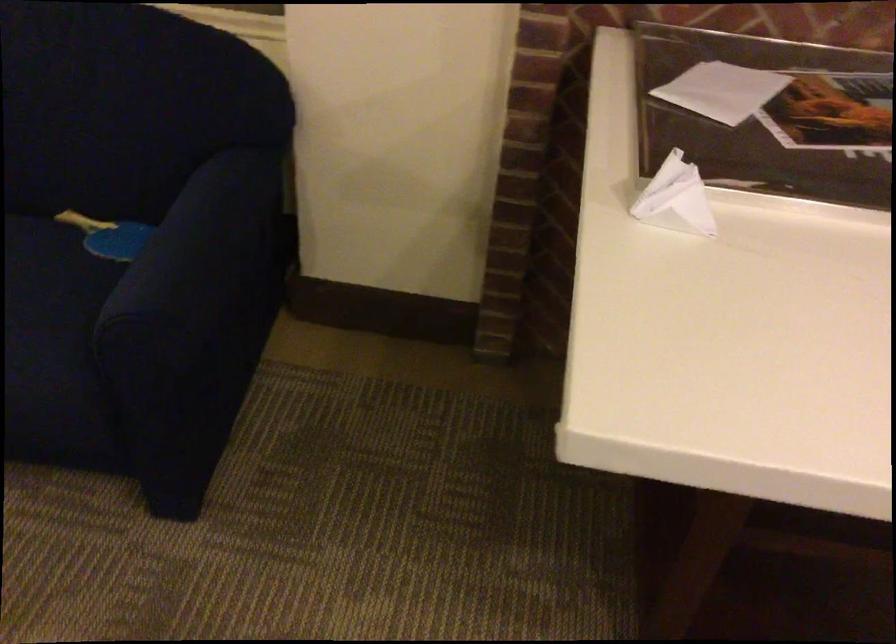
Describe the element at coordinates (62, 279) in the screenshot. This screenshot has height=644, width=896. I see `the blue sofa sitting surface` at that location.